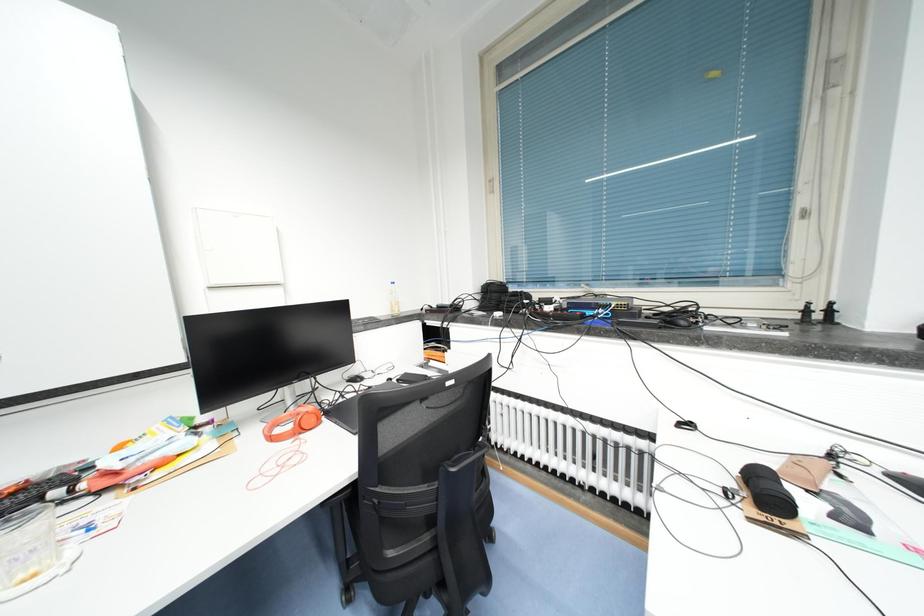
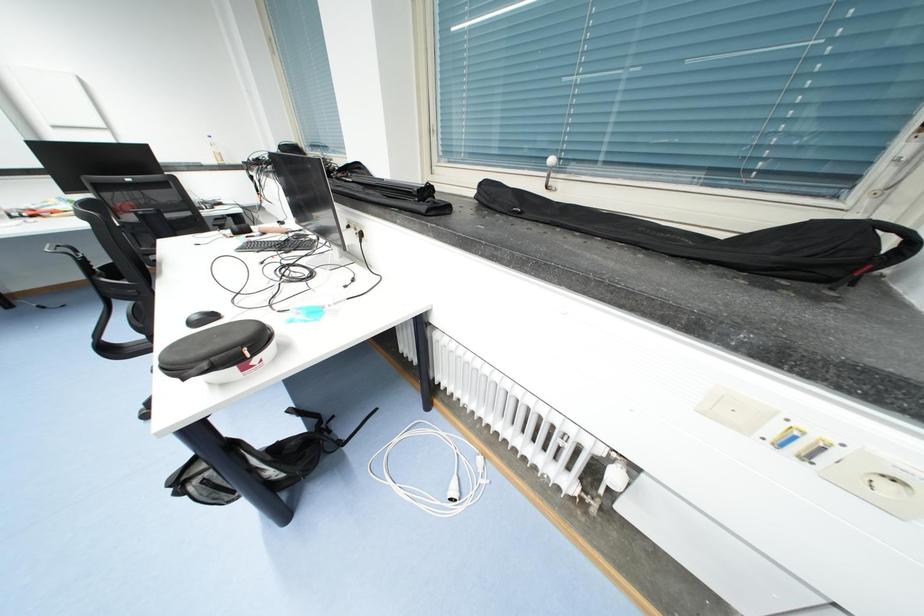
Looking at this image, which direction would the cameraman need to move to produce the second image?

The cameraman walked toward right, backward.